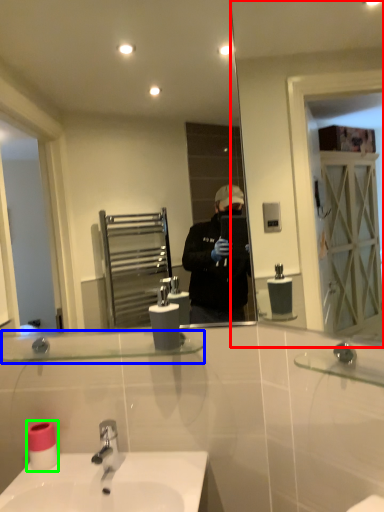
Question: Based on their relative distances, which object is farther from mirror (highlighted by a red box)? Choose from balustrade (highlighted by a blue box) and toilet paper (highlighted by a green box).

Choices:
 (A) balustrade
 (B) toilet paper

Answer: (B)